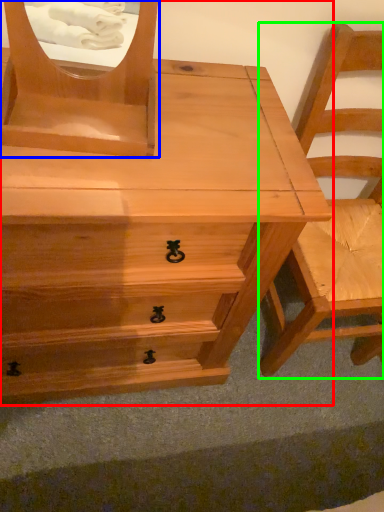
Question: Considering the real-world distances, which object is farthest from chest of drawers (highlighted by a red box)? mirror (highlighted by a blue box) or chair (highlighted by a green box)?

Choices:
 (A) mirror
 (B) chair

Answer: (B)